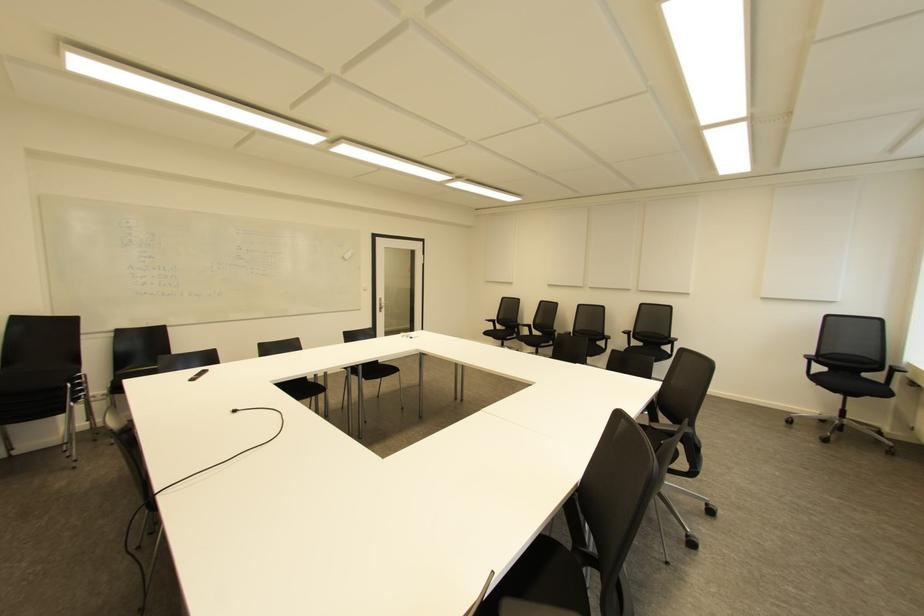
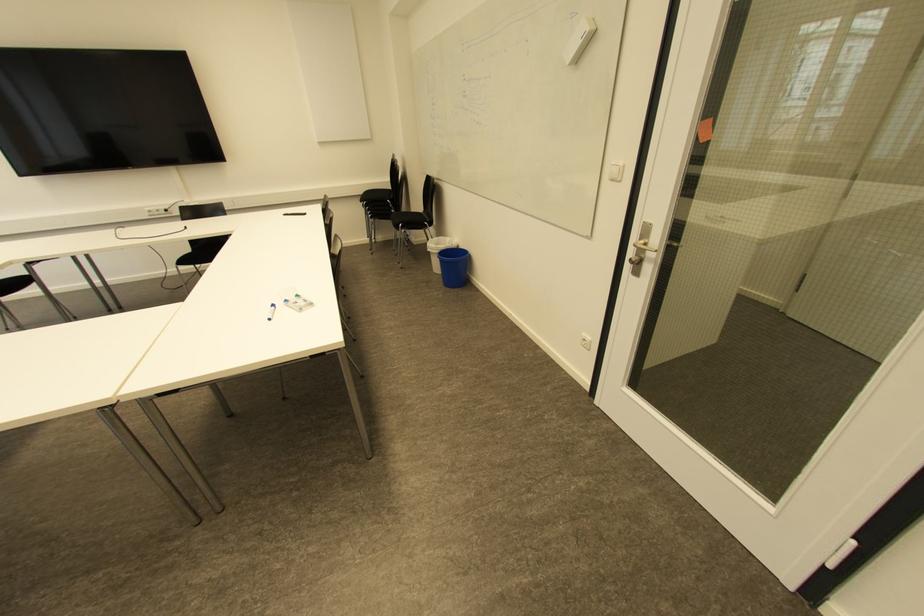
Where in the second image is the point corresponding to (x=380, y=308) from the first image?

(638, 262)